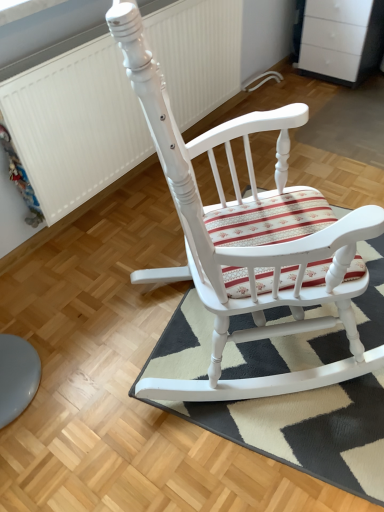
This screenshot has width=384, height=512. I want to click on free region under white textured radiator at upper left (from a real-world perspective), so click(x=121, y=196).